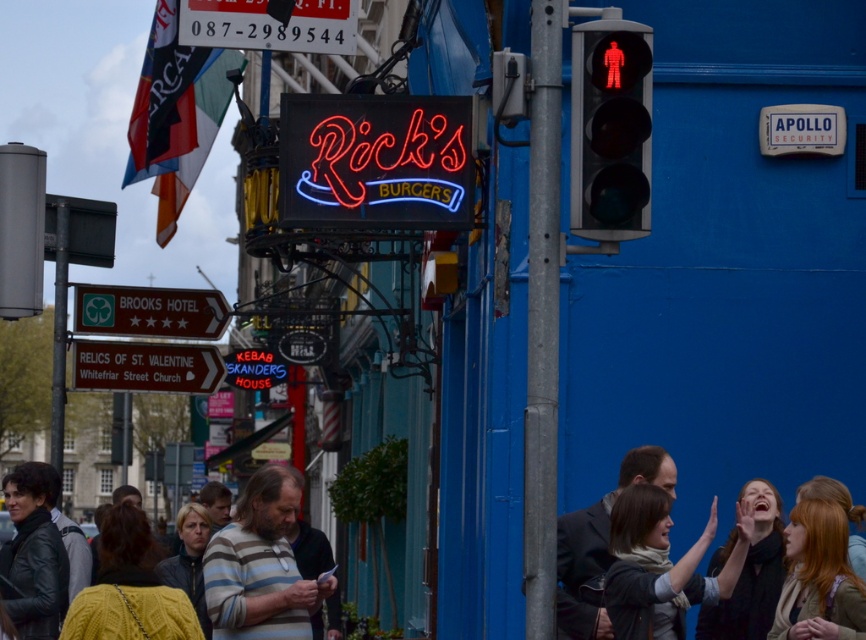
Can you confirm if greensignboardbrooks hotel sign at left is positioned below white wooden sign at lower left?

Actually, greensignboardbrooks hotel sign at left is above white wooden sign at lower left.

Does greensignboardbrooks hotel sign at left have a larger size compared to white wooden sign at lower left?

Yes.

Which is behind, point (178, 291) or point (176, 378)?

The point (178, 291) is more distant.

Find the location of a particular element. greensignboardbrooks hotel sign at left is located at coordinates (149, 310).

Is the position of neontexturedsign at center more distant than that of greensignboardbrooks hotel sign at left?

No, neontexturedsign at center is in front of greensignboardbrooks hotel sign at left.

Does point (430, 157) come in front of point (186, 312)?

Yes, point (430, 157) is closer to viewer.

The image size is (866, 640). I want to click on neontexturedsign at center, so click(x=375, y=161).

Between point (236, 10) and point (660, 474), which one is positioned behind?

Positioned behind is point (236, 10).

Who is taller, neon sign at upper center or matte black jacket at center?

matte black jacket at center

Where is `neon sign at upper center`? This screenshot has width=866, height=640. neon sign at upper center is located at coordinates (270, 24).